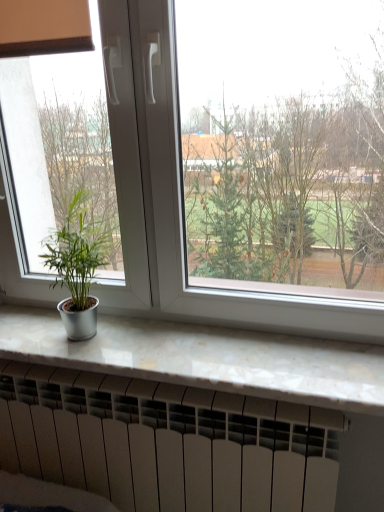
Question: Is the position of white marble counter top at lower center more distant than that of green matte plant at left?

Choices:
 (A) no
 (B) yes

Answer: (A)

Question: Is green matte plant at left at the back of white marble counter top at lower center?

Choices:
 (A) no
 (B) yes

Answer: (A)

Question: Considering the relative sizes of white marble counter top at lower center and green matte plant at left in the image provided, is white marble counter top at lower center wider than green matte plant at left?

Choices:
 (A) no
 (B) yes

Answer: (B)

Question: Is white marble counter top at lower center taller than green matte plant at left?

Choices:
 (A) yes
 (B) no

Answer: (B)

Question: Is white marble counter top at lower center placed right next to green matte plant at left?

Choices:
 (A) no
 (B) yes

Answer: (A)

Question: In terms of width, does white matte heater at bottom look wider or thinner when compared to green matte plant at left?

Choices:
 (A) thin
 (B) wide

Answer: (A)

Question: In terms of size, does white matte heater at bottom appear bigger or smaller than green matte plant at left?

Choices:
 (A) big
 (B) small

Answer: (A)

Question: From the image's perspective, relative to green matte plant at left, is white matte heater at bottom above or below?

Choices:
 (A) above
 (B) below

Answer: (B)

Question: Is white matte heater at bottom spatially inside green matte plant at left, or outside of it?

Choices:
 (A) outside
 (B) inside

Answer: (A)

Question: Is white marble counter top at lower center wider or thinner than green matte plant at left?

Choices:
 (A) thin
 (B) wide

Answer: (B)

Question: In terms of height, does white marble counter top at lower center look taller or shorter compared to green matte plant at left?

Choices:
 (A) tall
 (B) short

Answer: (B)

Question: From the image's perspective, relative to green matte plant at left, is white marble counter top at lower center above or below?

Choices:
 (A) above
 (B) below

Answer: (B)

Question: From a real-world perspective, is white marble counter top at lower center positioned above or below green matte plant at left?

Choices:
 (A) below
 (B) above

Answer: (A)

Question: From a real-world perspective, is white marble counter top at lower center physically located above or below white plastic window at center?

Choices:
 (A) below
 (B) above

Answer: (A)

Question: Considering their positions, is white marble counter top at lower center located in front of or behind white plastic window at center?

Choices:
 (A) behind
 (B) front

Answer: (A)